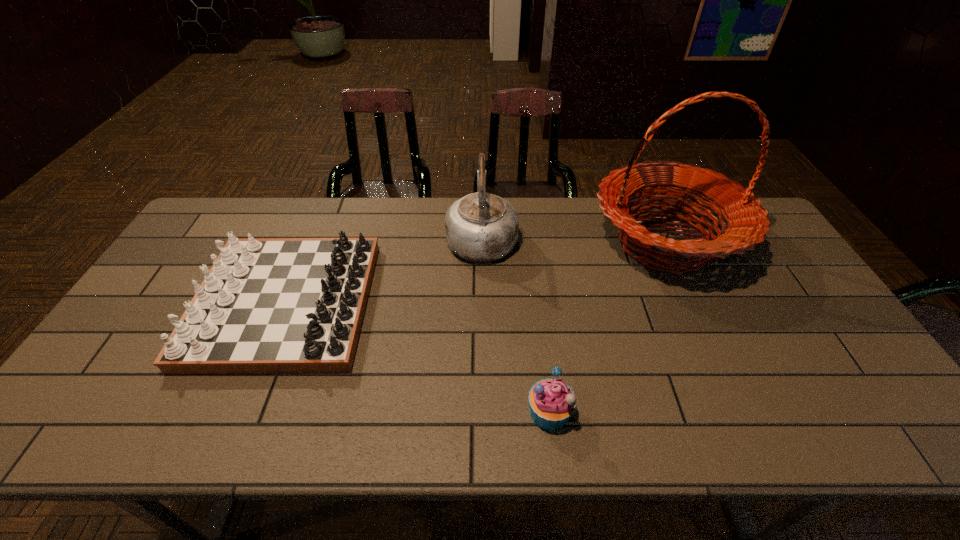
The height and width of the screenshot is (540, 960). I want to click on the rightmost object, so click(746, 222).

Where is `the tallest object`? This screenshot has width=960, height=540. the tallest object is located at coordinates (746, 222).

Identify the location of the second tallest object. (x=480, y=227).

The width and height of the screenshot is (960, 540). I want to click on the leftmost object, so click(268, 305).

The width and height of the screenshot is (960, 540). I want to click on muffin, so click(552, 402).

Where is `blank space located 0.120m on the front of the tallest object`? This screenshot has width=960, height=540. blank space located 0.120m on the front of the tallest object is located at coordinates (706, 333).

The image size is (960, 540). I want to click on vacant region located at the spout of the kettle, so click(482, 198).

Find the location of a particular element. This screenshot has width=960, height=540. free space located on the right of the leftmost object is located at coordinates click(x=441, y=304).

Locate an element on the screen. This screenshot has width=960, height=540. free point located on the back of the nearest object is located at coordinates (535, 287).

The width and height of the screenshot is (960, 540). I want to click on basket present at the far edge, so click(746, 222).